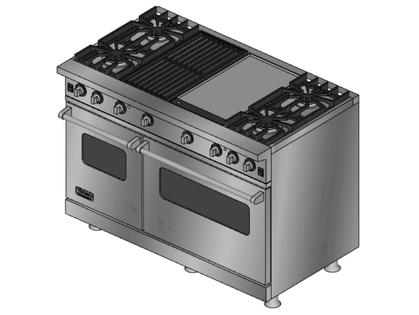
The height and width of the screenshot is (315, 419). Find the location of `left back hob plate`. left back hob plate is located at coordinates coord(156,32).